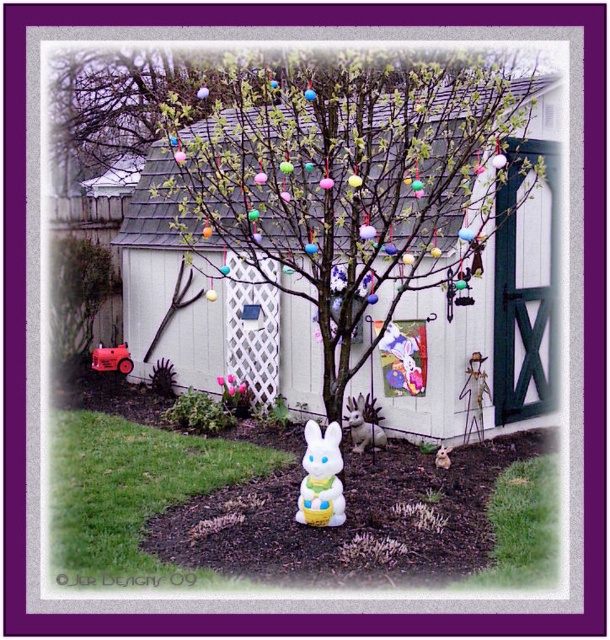
Is white wood at center further to the viewer compared to white plastic bunny at center?

That is False.

Does white wood at center appear on the right side of white plastic bunny at center?

Correct, you'll find white wood at center to the right of white plastic bunny at center.

Does point (318, 205) come closer to viewer compared to point (334, 442)?

That is False.

Locate an element on the screen. This screenshot has width=610, height=640. white wood at center is located at coordinates (359, 228).

This screenshot has height=640, width=610. What do you see at coordinates (292, 508) in the screenshot?
I see `white glossy plastic bunny at center` at bounding box center [292, 508].

Between point (476, 541) and point (317, 428), which one is positioned behind?

The point (317, 428) is behind.

You are a GUI agent. You are given a task and a screenshot of the screen. Output one action in this format:
    pyautogui.click(x=<x>, y=<y>)
    Task: Click on the white glossy plastic bunny at center
    
    Given the screenshot: What is the action you would take?
    pyautogui.click(x=292, y=508)

Is white wood at center smaller than white glossy plastic bunny at center?

Actually, white wood at center might be larger than white glossy plastic bunny at center.

Can you confirm if white wood at center is positioned below white glossy plastic bunny at center?

Actually, white wood at center is above white glossy plastic bunny at center.

What do you see at coordinates (359, 228) in the screenshot? Image resolution: width=610 pixels, height=640 pixels. I see `white wood at center` at bounding box center [359, 228].

Locate an element on the screen. white wood at center is located at coordinates (359, 228).